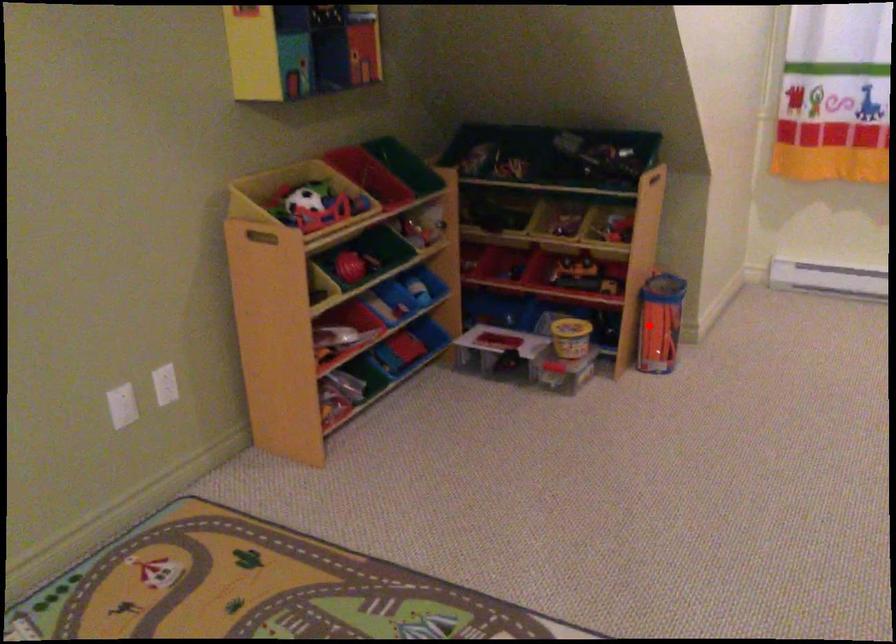
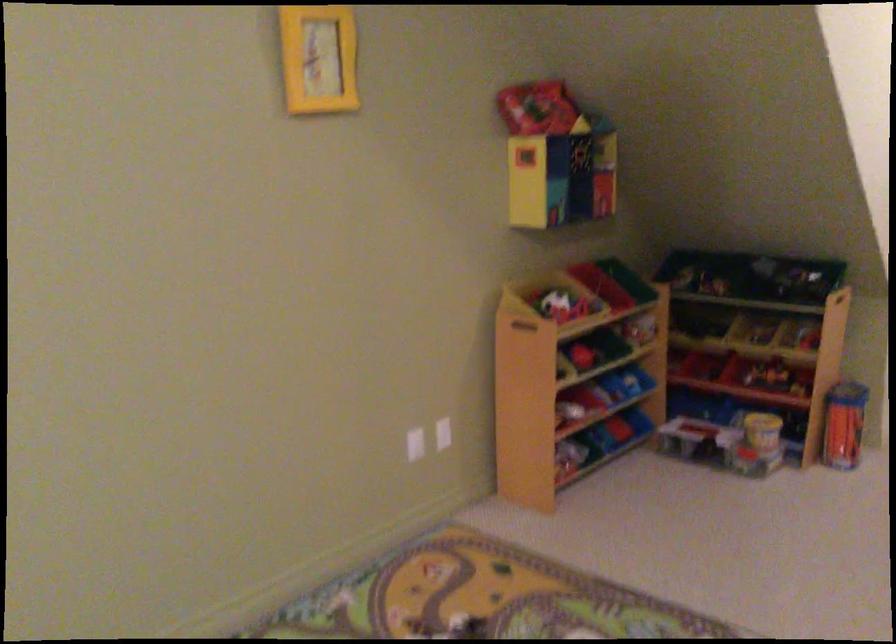
Find the pixel in the second image that matches the highlighted location in the first image.

(843, 424)